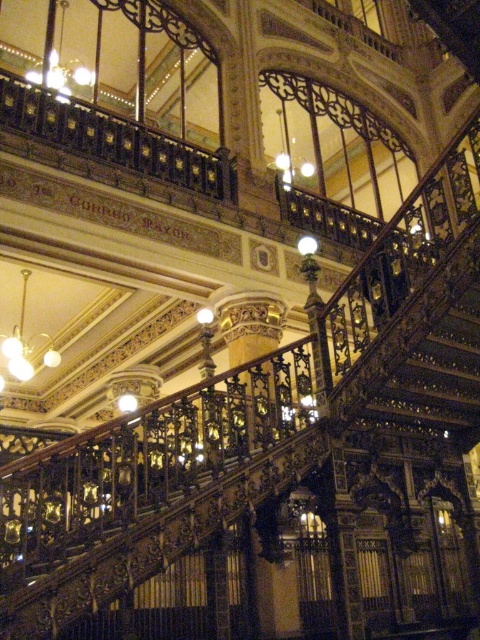
Question: Is metallic chandelier at upper left wider than matte gold chandelier at upper left?

Choices:
 (A) yes
 (B) no

Answer: (A)

Question: Is metallic chandelier at upper left to the left of matte gold chandelier at upper left from the viewer's perspective?

Choices:
 (A) yes
 (B) no

Answer: (B)

Question: Does metallic chandelier at upper left appear on the left side of matte gold chandelier at upper left?

Choices:
 (A) no
 (B) yes

Answer: (A)